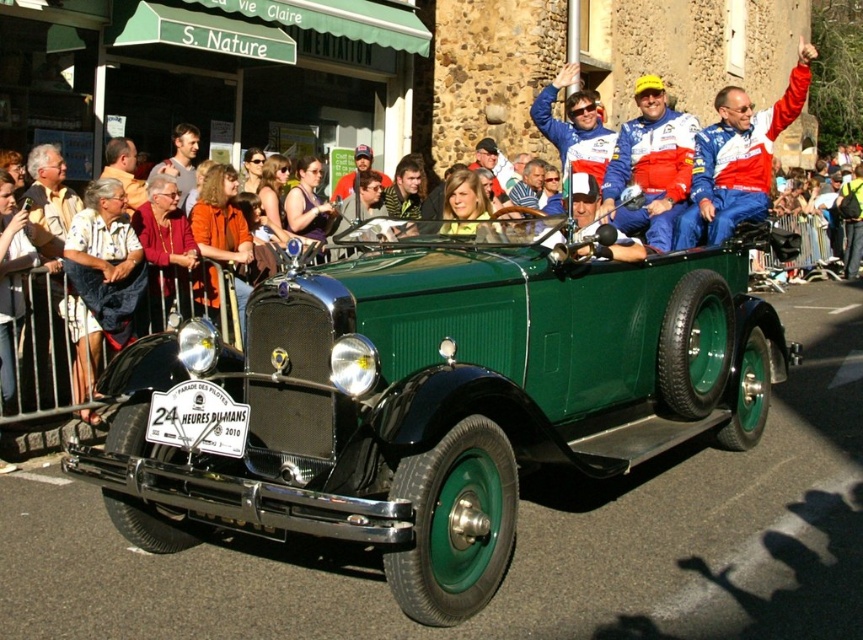
Question: Which point appears closest to the camera in this image?

Choices:
 (A) (734, 196)
 (B) (143, 180)

Answer: (A)

Question: Which point is closer to the camera?

Choices:
 (A) (719, 221)
 (B) (124, 148)
 (C) (190, 147)
 (D) (446, 509)

Answer: (D)

Question: Among these objects, which one is nearest to the camera?

Choices:
 (A) matte orange shirt at upper center
 (B) matte orange shirt at left

Answer: (B)

Question: From the image, what is the correct spatial relationship of red and white racing suit at center in relation to matte orange shirt at left?

Choices:
 (A) below
 (B) above

Answer: (B)

Question: Where is matte orange shirt at upper center located in relation to matte orange shirt at left in the image?

Choices:
 (A) below
 (B) above

Answer: (B)

Question: Does green matte vintage car at center have a greater width compared to red and white racing suit at center?

Choices:
 (A) yes
 (B) no

Answer: (B)